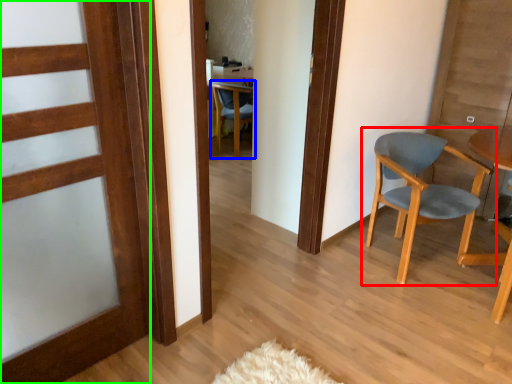
Question: Which object is positioned closest to chair (highlighted by a red box)? Select from chair (highlighted by a blue box) and door (highlighted by a green box).

Choices:
 (A) chair
 (B) door

Answer: (B)